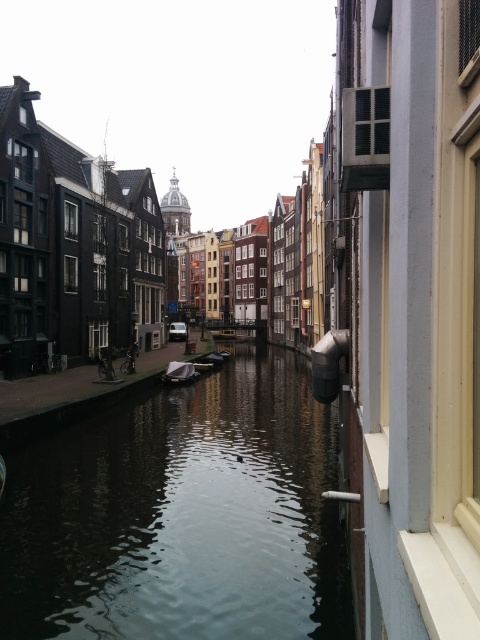
Question: Can you confirm if dark reflective water at center is positioned above metallic gray boat at center?

Choices:
 (A) no
 (B) yes

Answer: (A)

Question: Estimate the real-world distances between objects in this image. Which object is farther from the dark reflective water at center?

Choices:
 (A) metallic gray boat at center
 (B) wooden boat at center

Answer: (B)

Question: Which point is closer to the camera?

Choices:
 (A) dark reflective water at center
 (B) metallic gray boat at center

Answer: (A)

Question: Estimate the real-world distances between objects in this image. Which object is closer to the dark reflective water at center?

Choices:
 (A) metallic gray boat at center
 (B) wooden boat at center

Answer: (A)

Question: Observing the image, what is the correct spatial positioning of dark reflective water at center in reference to metallic gray boat at center?

Choices:
 (A) above
 (B) below

Answer: (B)

Question: Is metallic gray boat at center further to camera compared to wooden boat at center?

Choices:
 (A) yes
 (B) no

Answer: (B)